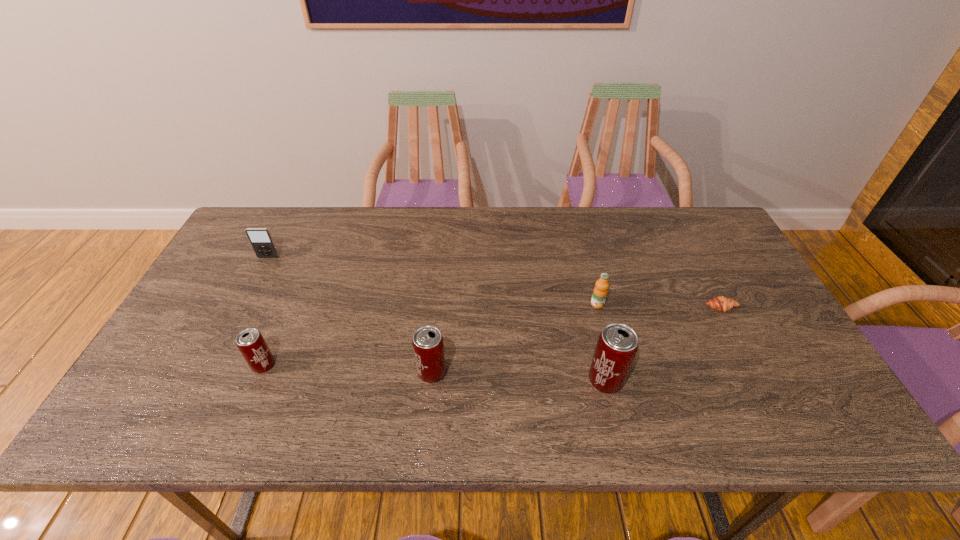
The width and height of the screenshot is (960, 540). In order to click on orange juice in this screenshot , I will do `click(600, 291)`.

Identify the location of vacant space located 0.120m on the right of the shortest beer can. This screenshot has height=540, width=960. (324, 365).

Find the location of a particular element. The width and height of the screenshot is (960, 540). free point located on the right of the second tallest beer can is located at coordinates (613, 373).

Where is `vacant space located on the right of the tallest object`? Image resolution: width=960 pixels, height=540 pixels. vacant space located on the right of the tallest object is located at coordinates (691, 381).

The width and height of the screenshot is (960, 540). I want to click on vacant space located 0.340m on the front-facing side of the iPod, so click(x=221, y=348).

The width and height of the screenshot is (960, 540). What are the coordinates of `free region located on the front-facing side of the shortest object` in the screenshot? It's located at click(736, 338).

Find the location of `vacant area situated 0.080m on the label of the orange juice`. vacant area situated 0.080m on the label of the orange juice is located at coordinates (605, 332).

The image size is (960, 540). Find the location of `object present at the left edge`. object present at the left edge is located at coordinates (261, 240).

At what (x,y) coordinates should I click in order to perform the action: click on object that is at the right edge. Please return your answer as a coordinate pair (x, y). Image resolution: width=960 pixels, height=540 pixels. Looking at the image, I should click on (721, 303).

The height and width of the screenshot is (540, 960). In order to click on free space at the far edge in this screenshot , I will do `click(363, 214)`.